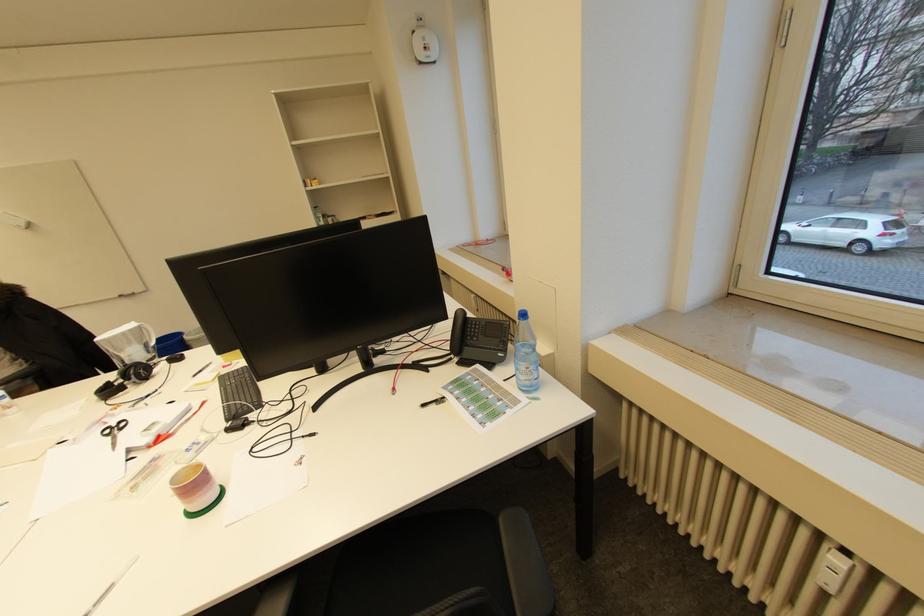
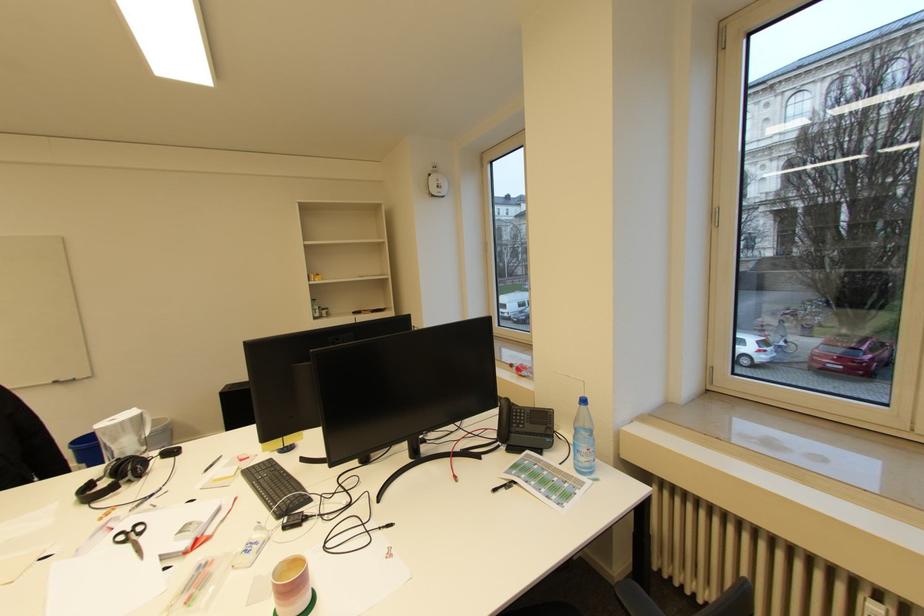
In the second image, find the point that corresponds to the point at 155,440 in the first image.

(192, 544)